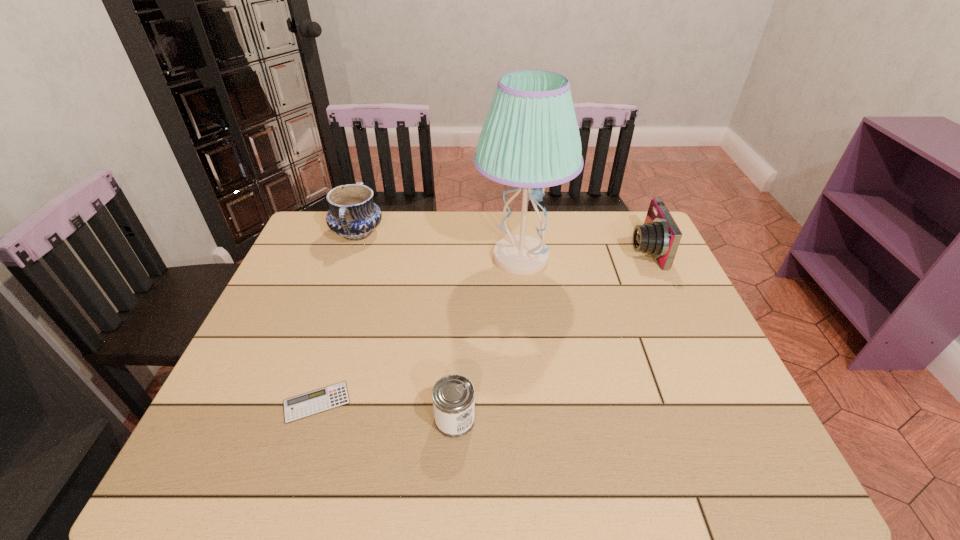
The width and height of the screenshot is (960, 540). Identify the location of lamp. (530, 139).

The width and height of the screenshot is (960, 540). In order to click on pottery in this screenshot , I will do `click(353, 215)`.

Where is `camera`? camera is located at coordinates (659, 236).

Locate an element on the screen. The image size is (960, 540). the fourth tallest object is located at coordinates (453, 396).

Find the location of `calculator`. calculator is located at coordinates (320, 400).

Find the location of a particular element. This screenshot has height=540, width=960. vacant area situated 0.120m on the front of the tallest object is located at coordinates (528, 321).

Find the location of a particular element. vacant space located 0.180m on the front of the pottery is located at coordinates (336, 292).

Locate an element on the screen. Image resolution: width=960 pixels, height=540 pixels. vacant region located on the front-facing side of the camera is located at coordinates (551, 249).

Locate an element on the screen. Image resolution: width=960 pixels, height=540 pixels. vacant space located 0.340m on the front-facing side of the camera is located at coordinates (518, 249).

I want to click on vacant region located 0.160m on the front-facing side of the camera, so click(x=576, y=249).